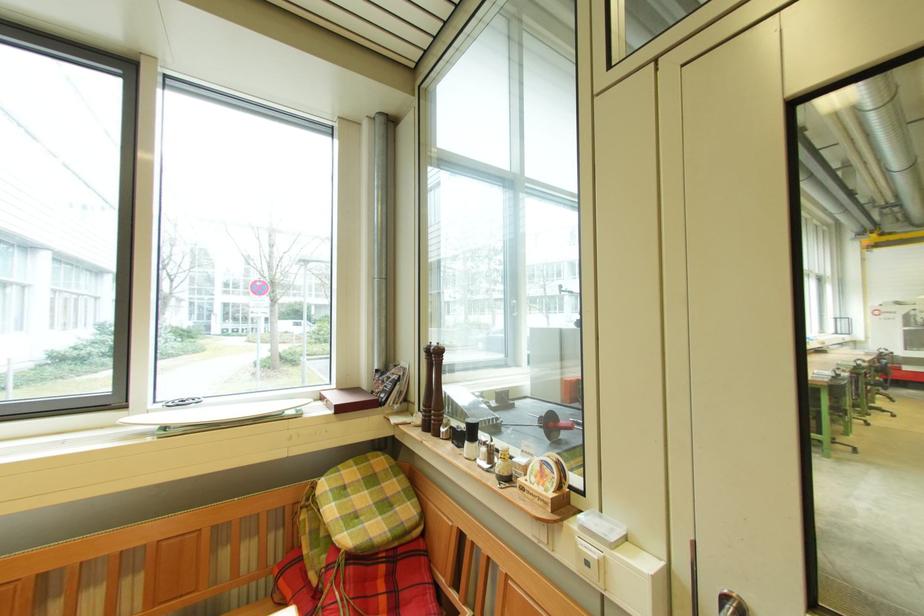
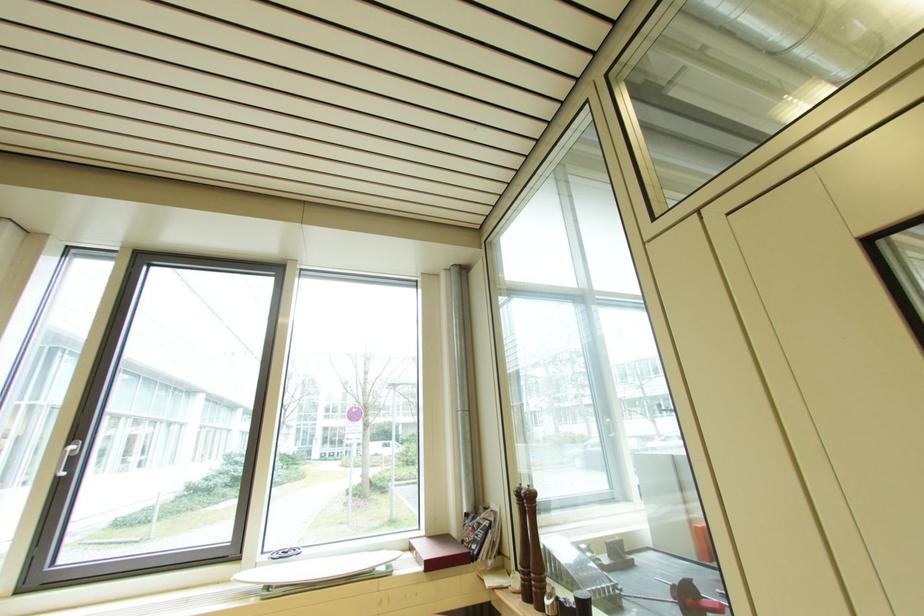
In the second image, find the point that corresponds to pixel 432 355 in the first image.

(524, 498)